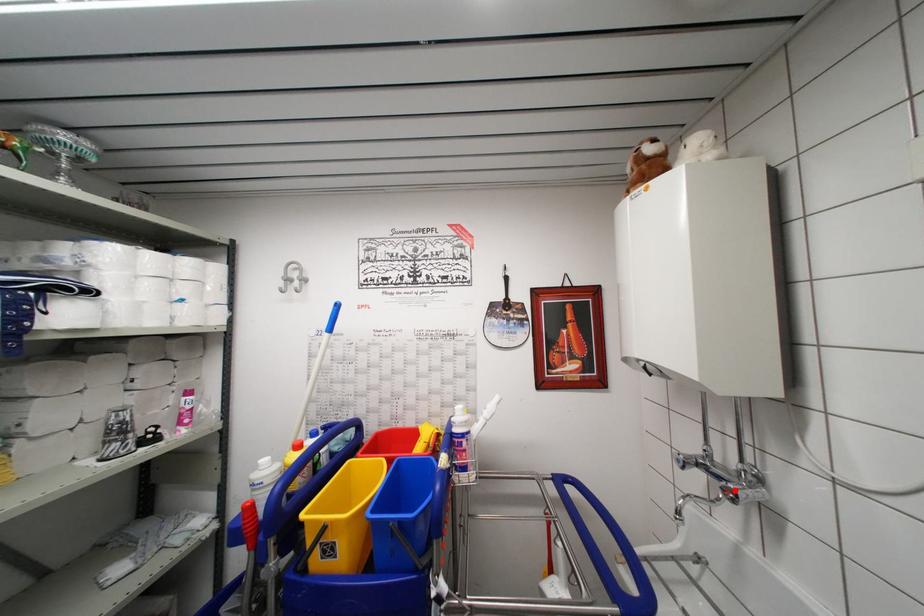
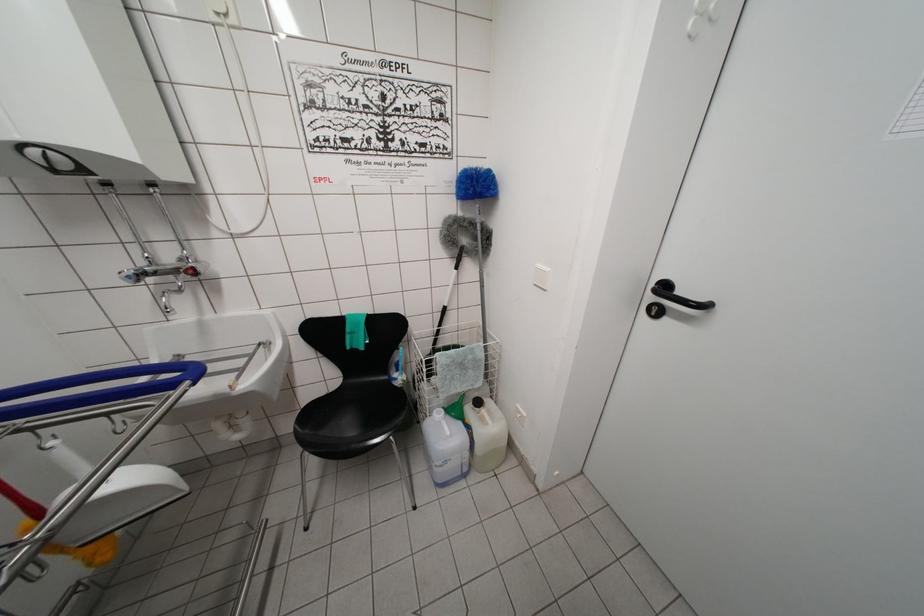
Find the pixel in the second image that matches the highlighted location in the first image.

(193, 270)